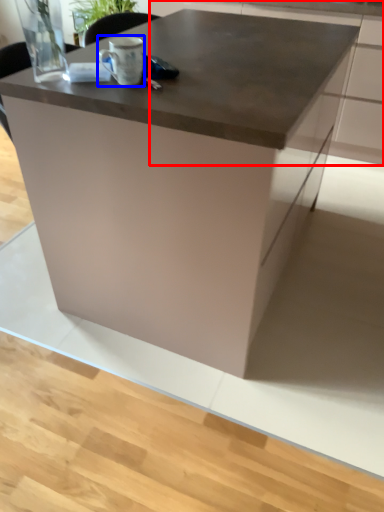
Question: Which object appears closest to the camera in this image, cabinetry (highlighted by a red box) or coffee cup (highlighted by a blue box)?

Choices:
 (A) cabinetry
 (B) coffee cup

Answer: (B)